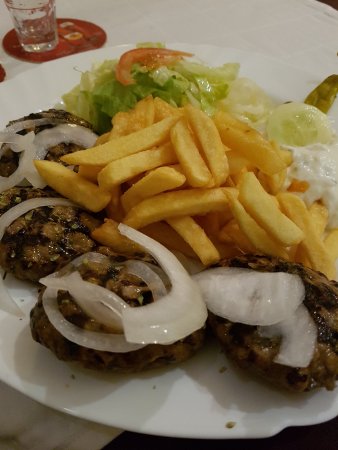
Image resolution: width=338 pixels, height=450 pixels. What are the coordinates of `plate` in the screenshot? It's located at (77, 64).